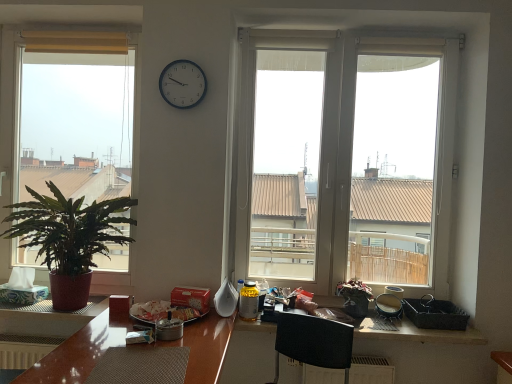
Image resolution: width=512 pixels, height=384 pixels. Find the location of `vacant region above matte yellow curtain at upper left (from a real-world perspective)`. vacant region above matte yellow curtain at upper left (from a real-world perspective) is located at coordinates (68, 30).